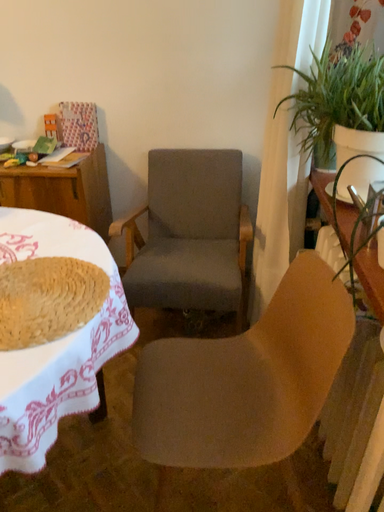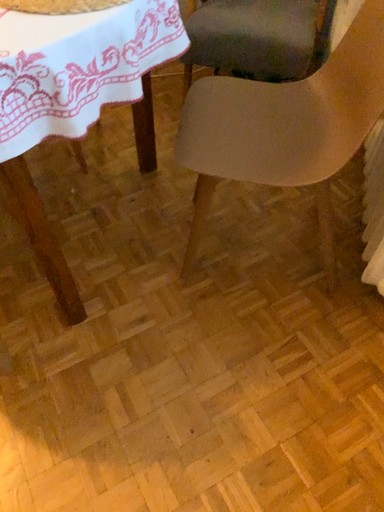
Question: Which way did the camera rotate in the video?

Choices:
 (A) rotated right
 (B) rotated left

Answer: (B)